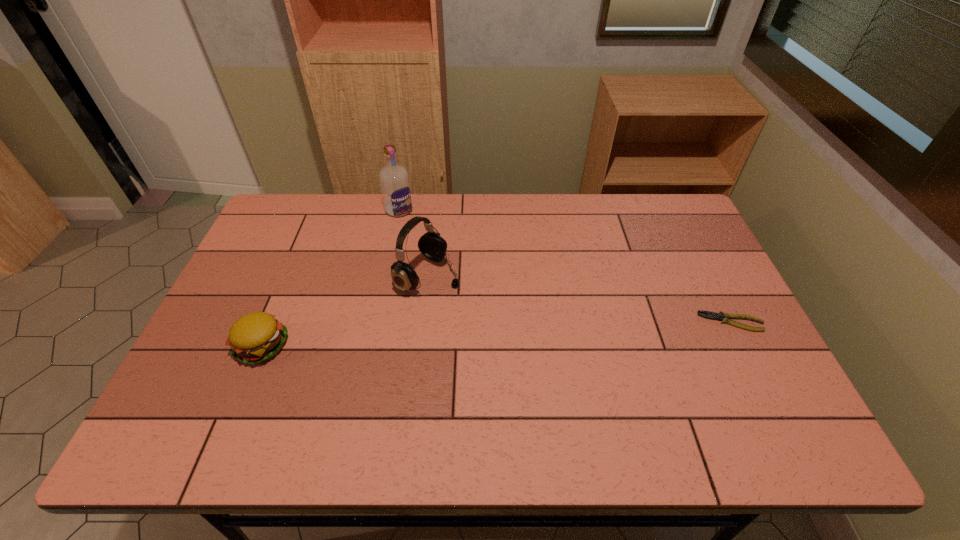
Locate an element on the screen. the second shortest object is located at coordinates (256, 337).

Identify the location of hamburger. The height and width of the screenshot is (540, 960). (256, 337).

The image size is (960, 540). What are the coordinates of `pliers` in the screenshot? It's located at (721, 316).

What are the coordinates of `the shortest object` in the screenshot? It's located at (721, 316).

You are a GUI agent. You are given a task and a screenshot of the screen. Output one action in this format:
    pyautogui.click(x=<x>, y=<y>)
    Task: Click on the second tallest object
    
    Given the screenshot: What is the action you would take?
    pyautogui.click(x=431, y=244)

Where is `headset`? This screenshot has height=540, width=960. headset is located at coordinates (431, 244).

Find the location of a particular element. the farthest object is located at coordinates (394, 180).

Find the location of `blank area located 0.220m on the right of the leftmost object`. blank area located 0.220m on the right of the leftmost object is located at coordinates (374, 346).

What are the coordinates of `free space located on the left of the rightmost object` in the screenshot? It's located at (x=586, y=322).

The height and width of the screenshot is (540, 960). In order to click on free space located 0.130m with the microphone on the side of the second tallest object in this screenshot , I will do `click(493, 306)`.